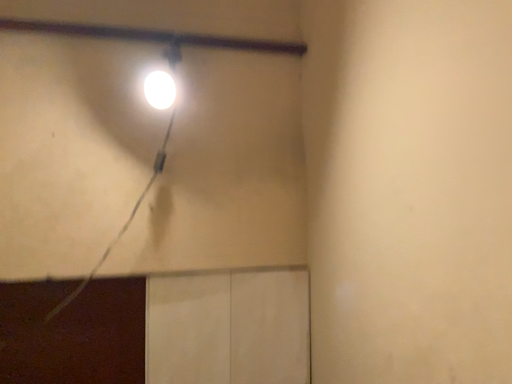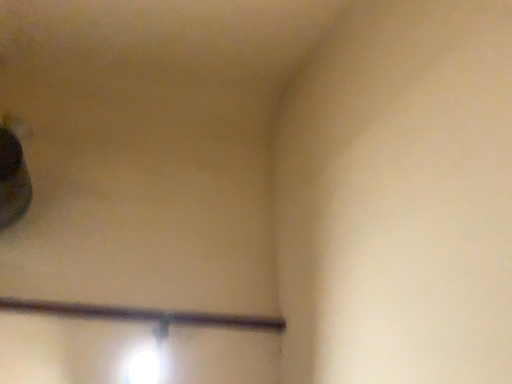
Question: How did the camera likely rotate when shooting the video?

Choices:
 (A) rotated upward
 (B) rotated downward

Answer: (A)